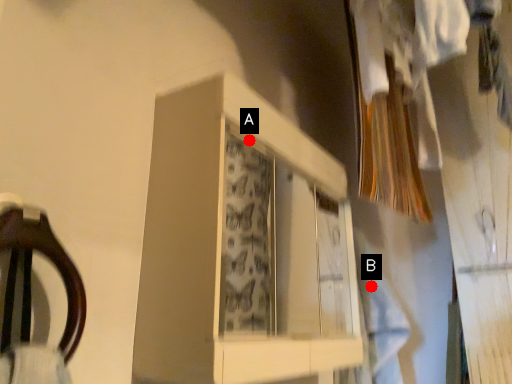
Question: Two points are circled on the image, labeled by A and B beside each circle. Which point is farther to the camera?

Choices:
 (A) A is further
 (B) B is further

Answer: (B)